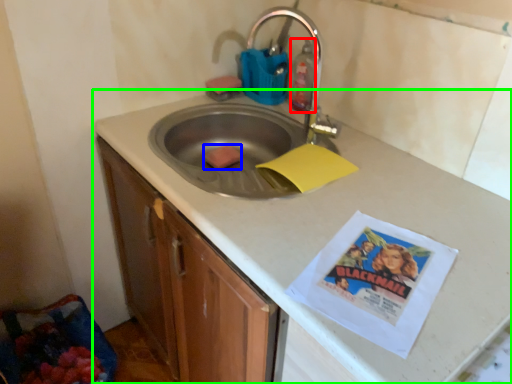
Question: Estimate the real-world distances between objects in this image. Which object is farther from cleaning product (highlighted by a red box), food (highlighted by a blue box) or countertop (highlighted by a green box)?

Choices:
 (A) food
 (B) countertop

Answer: (B)